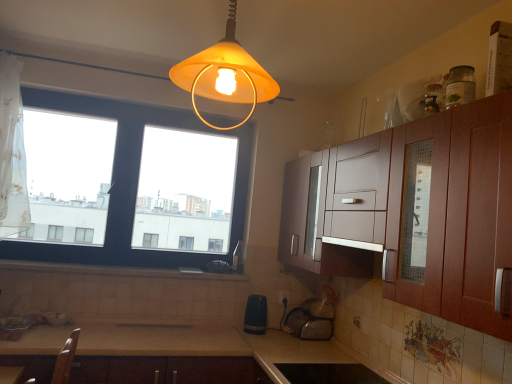
Question: From a real-world perspective, is beige laminate countertop at lower center physically below matte yellow glass lampshade at upper center?

Choices:
 (A) no
 (B) yes

Answer: (B)

Question: From the image's perspective, is beige laminate countertop at lower center located beneath matte yellow glass lampshade at upper center?

Choices:
 (A) no
 (B) yes

Answer: (B)

Question: Does beige laminate countertop at lower center contain matte yellow glass lampshade at upper center?

Choices:
 (A) yes
 (B) no

Answer: (B)

Question: Is beige laminate countertop at lower center to the right of matte yellow glass lampshade at upper center from the viewer's perspective?

Choices:
 (A) yes
 (B) no

Answer: (B)

Question: Considering the relative sizes of beige laminate countertop at lower center and matte yellow glass lampshade at upper center in the image provided, is beige laminate countertop at lower center smaller than matte yellow glass lampshade at upper center?

Choices:
 (A) no
 (B) yes

Answer: (A)

Question: From the image's perspective, is matte white electric outlet at lower center located above or below white tile at lower center?

Choices:
 (A) above
 (B) below

Answer: (B)

Question: Would you say matte white electric outlet at lower center is to the left or to the right of white tile at lower center in the picture?

Choices:
 (A) right
 (B) left

Answer: (A)

Question: Choose the correct answer: Is matte white electric outlet at lower center inside white tile at lower center or outside it?

Choices:
 (A) outside
 (B) inside

Answer: (A)

Question: In terms of height, does matte white electric outlet at lower center look taller or shorter compared to white tile at lower center?

Choices:
 (A) tall
 (B) short

Answer: (A)

Question: From their relative heights in the image, would you say matte white electric outlet at lower center is taller or shorter than matte yellow glass lampshade at upper center?

Choices:
 (A) short
 (B) tall

Answer: (A)

Question: From a real-world perspective, is matte white electric outlet at lower center positioned above or below matte yellow glass lampshade at upper center?

Choices:
 (A) above
 (B) below

Answer: (B)

Question: Considering the positions of matte white electric outlet at lower center and matte yellow glass lampshade at upper center in the image, is matte white electric outlet at lower center wider or thinner than matte yellow glass lampshade at upper center?

Choices:
 (A) thin
 (B) wide

Answer: (A)

Question: Considering the positions of matte white electric outlet at lower center and matte yellow glass lampshade at upper center in the image, is matte white electric outlet at lower center bigger or smaller than matte yellow glass lampshade at upper center?

Choices:
 (A) big
 (B) small

Answer: (B)

Question: From the image's perspective, is white tile at lower center positioned above or below metallic silver sink at lower center, placed as the second appliance when sorted from bottom to top?

Choices:
 (A) above
 (B) below

Answer: (A)

Question: Is white tile at lower center taller or shorter than metallic silver sink at lower center, which appears as the 3th appliance when viewed from the top?

Choices:
 (A) short
 (B) tall

Answer: (A)